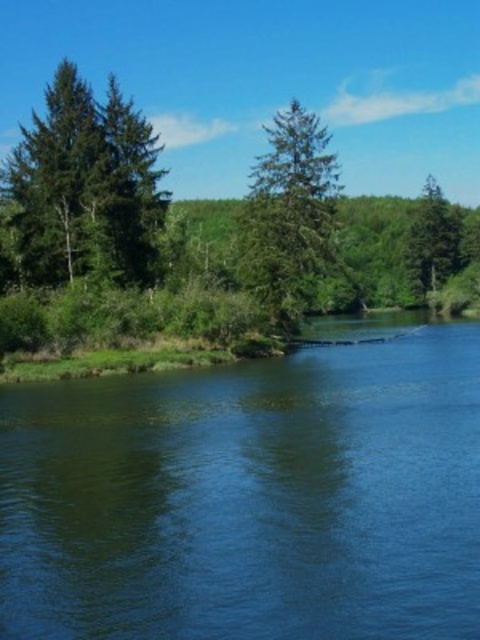
You are standing at the center of the scene and want to walk towards the green grassy river at lower left. Which direction should you move relative to the green matte tree at upper right?

You should move downward towards the green grassy river at lower left, as it is positioned under the green matte tree at upper right.

You are a bird flying over the serene natural landscape. You see the green matte tree at left and the green matte tree at center. Which tree should you land on if you want to perch on the taller one?

The green matte tree at left is taller than the green matte tree at center, so you should land on the green matte tree at left.

You are standing at the center of the image and want to walk towards the green matte tree at center. In which direction should you move?

The green matte tree at center is already at the center of the image, so you don not need to move in any direction to reach it.